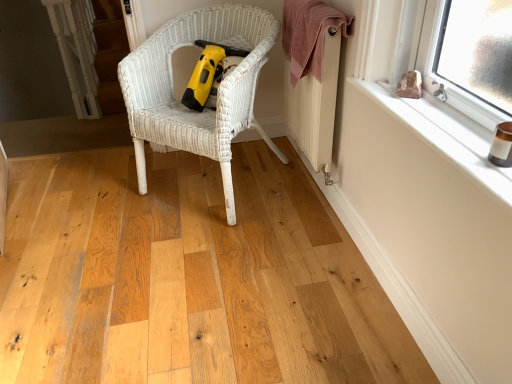
Find the location of `free space above white painted wood at upper right (from a real-world perspective)`. free space above white painted wood at upper right (from a real-world perspective) is located at coordinates 433,124.